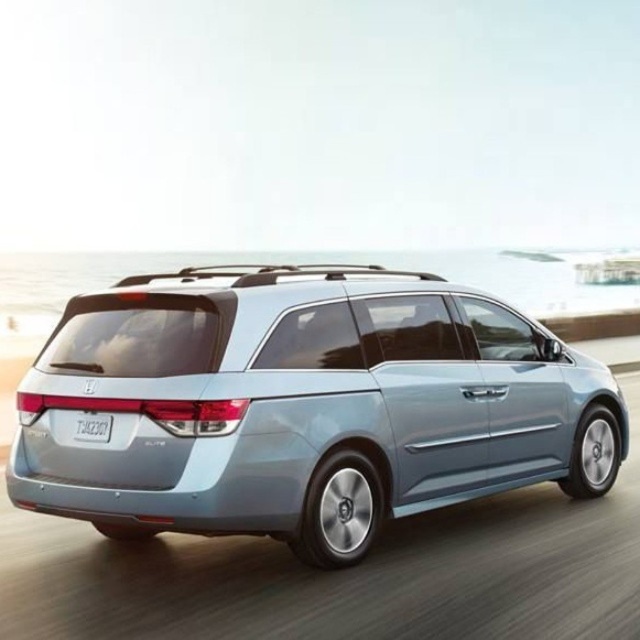
You are a photographer trying to capture the license plate of the satin metallic minivan at center. Since the vehicle is moving, you need to focus on the white plastic license plate at center first. Is the license plate located above or below the minivan?

The satin metallic minivan at center is positioned under the white plastic license plate at center, so the license plate is located above the minivan.

You are a photographer trying to capture the entire license plate and the minivan in one shot. Given that the camera can only focus on objects within a 1.5 meter width, will you be able to fit both the satin metallic minivan at center and the white plastic license plate at center in the frame?

The satin metallic minivan at center is wider than the white plastic license plate at center. Since the camera can focus on objects within a 1.5 meter width, it depends on the actual widths of both objects. However, the description only states the minivan is wider, but not the exact measurements. Without specific dimensions, we cannot confirm if both will fit within the 1.5 meter limit.